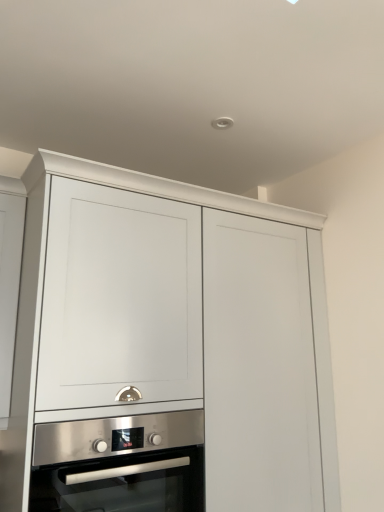
Question: Considering the positions of matte white cabinet at center and stainless steel oven at center in the image, is matte white cabinet at center bigger or smaller than stainless steel oven at center?

Choices:
 (A) big
 (B) small

Answer: (A)

Question: Considering the positions of matte white cabinet at center and stainless steel oven at center in the image, is matte white cabinet at center wider or thinner than stainless steel oven at center?

Choices:
 (A) thin
 (B) wide

Answer: (B)

Question: Is matte white cabinet at center to the left or to the right of stainless steel oven at center in the image?

Choices:
 (A) right
 (B) left

Answer: (A)

Question: Looking at the image, does stainless steel oven at center seem bigger or smaller compared to matte white cabinet at center?

Choices:
 (A) big
 (B) small

Answer: (B)

Question: From a real-world perspective, is stainless steel oven at center above or below matte white cabinet at center?

Choices:
 (A) above
 (B) below

Answer: (B)

Question: Choose the correct answer: Is stainless steel oven at center inside matte white cabinet at center or outside it?

Choices:
 (A) inside
 (B) outside

Answer: (A)

Question: Considering the relative positions of stainless steel oven at center and matte white cabinet at center in the image provided, is stainless steel oven at center to the left or to the right of matte white cabinet at center?

Choices:
 (A) right
 (B) left

Answer: (B)